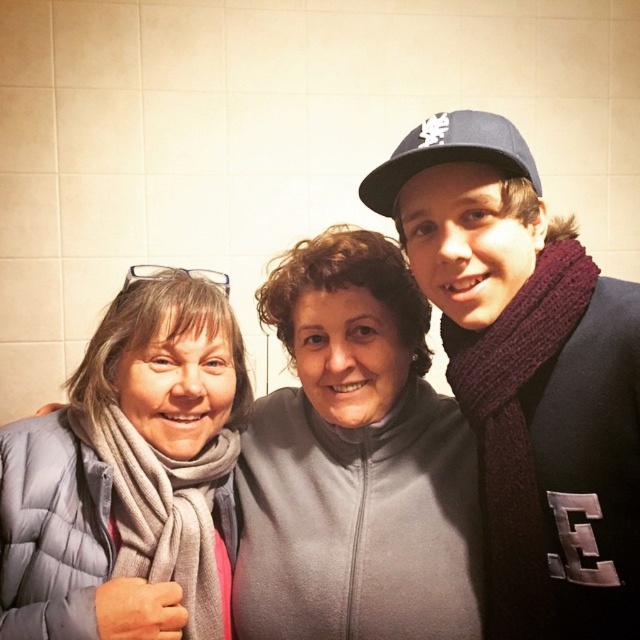
Based on the photo, you are a photographer setting up for a group photo. You notice the knitted dark red scarf at right and the gray quilted jacket at left in your frame. Which object appears taller in the photo?

The knitted dark red scarf at right appears taller than the gray quilted jacket at left in the photo.

You are a photographer preparing to take a group photo of the three people in the scene. You need to ensure that the knitted dark red scarf at right and the gray quilted jacket at center are both clearly visible in the frame. Based on their sizes, which item should you focus on first to ensure it is in focus?

The knitted dark red scarf at right is taller than the gray quilted jacket at center, so you should focus on the knitted dark red scarf at right first to ensure it is in focus.

You are a photographer trying to capture a clear photo of both the gray quilted jacket at center and the gray quilted jacket at left. Based on their positions, which one is closer to the camera?

The gray quilted jacket at center is closer to the camera because the gray quilted jacket at left is behind it.